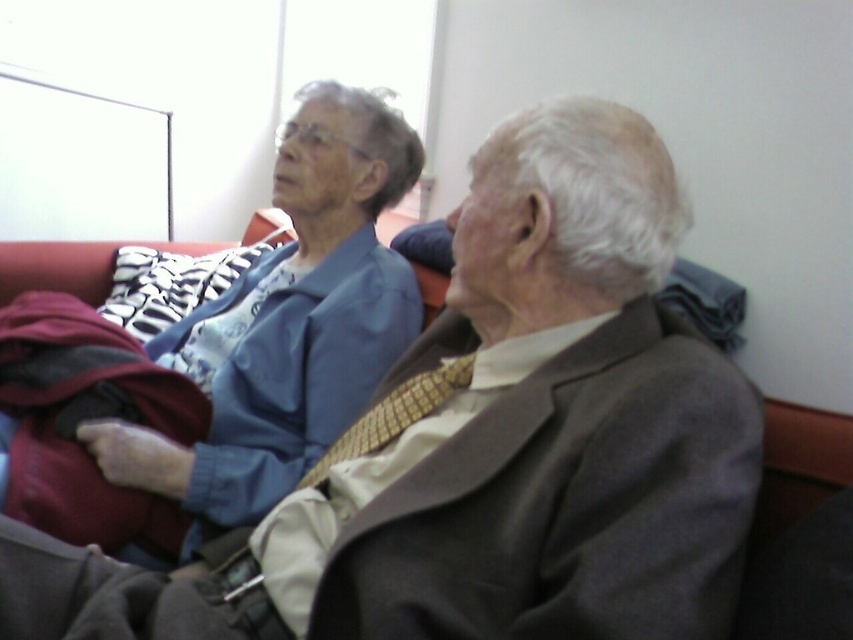
From the picture: You are a tailor measuring fabrics and accessories for a client. You have a blue fabric at left and a yellow textured tie at center. Which item has a greater width?

The blue fabric at left has a greater width than the yellow textured tie at center, as stated in the description that blue fabric at left surpasses yellow textured tie at center in width.

You are an interior designer assessing the color contrast between the blue fabric at left and the yellow textured tie at center in the image. Which object has a larger physical size?

The blue fabric at left is larger in size than the yellow textured tie at center, so the blue fabric at left has a larger physical size.